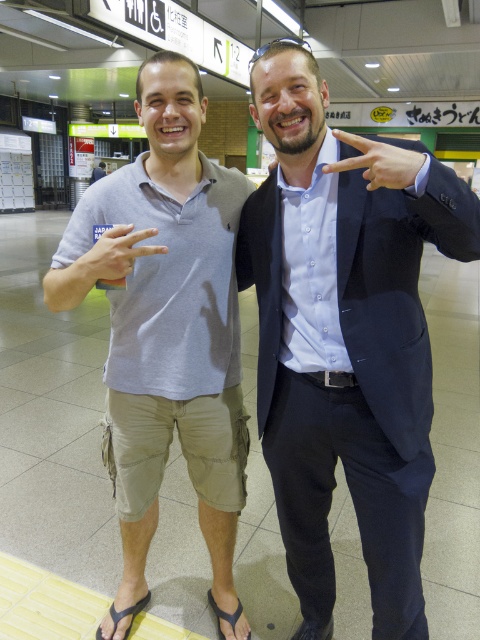
Question: Which is nearer to the gray cotton polo shirt at left?

Choices:
 (A) black rubber sandal at lower left
 (B) matte gray shirt at left
 (C) matte blue suit at center

Answer: (C)

Question: Does matte blue suit at center appear under matte gray shirt at left?

Choices:
 (A) yes
 (B) no

Answer: (A)

Question: Is gray cotton polo shirt at left to the right of matte black hand at center from the viewer's perspective?

Choices:
 (A) no
 (B) yes

Answer: (A)

Question: Estimate the real-world distances between objects in this image. Which object is closer to the matte blue suit at center?

Choices:
 (A) black rubber sandal at lower left
 (B) matte gray shirt at left

Answer: (B)

Question: Does matte blue suit at center lie behind matte gray shirt at left?

Choices:
 (A) no
 (B) yes

Answer: (A)

Question: Which object appears closest to the camera in this image?

Choices:
 (A) matte blue suit at center
 (B) gray cotton polo shirt at left
 (C) black rubber sandal at lower left

Answer: (A)